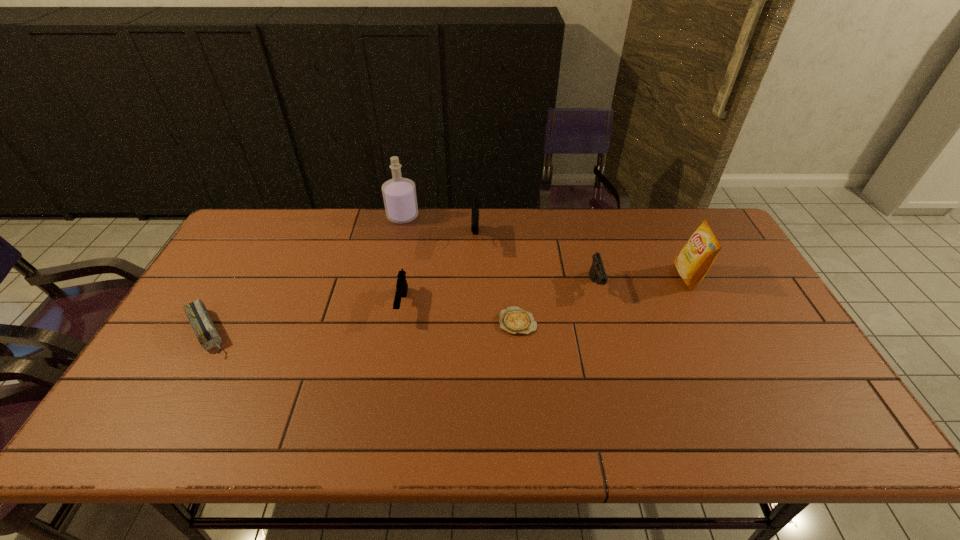
At what (x,y) coordinates should I click in order to perform the action: click on object that ranks as the fifth closest to the tallest object. Please return your answer as a coordinate pair (x, y). The height and width of the screenshot is (540, 960). Looking at the image, I should click on (597, 273).

Identify which pistol is the second closest to the sixth object from left to right. Please provide its 2D coordinates. Your answer should be formatted as a tuple, i.e. [(x, y)], where the tuple contains the x and y coordinates of a point satisfying the conditions above.

[(401, 287)]

Select which pistol appears as the second closest to the sixth object from left to right. Please provide its 2D coordinates. Your answer should be formatted as a tuple, i.e. [(x, y)], where the tuple contains the x and y coordinates of a point satisfying the conditions above.

[(401, 287)]

At what (x,y) coordinates should I click in order to perform the action: click on vacant space that satisfies the following two spatial constraints: 1. on the back side of the shortest object; 2. on the right side of the leftmost object. Please return your answer as a coordinate pair (x, y). The image size is (960, 540). Looking at the image, I should click on (213, 322).